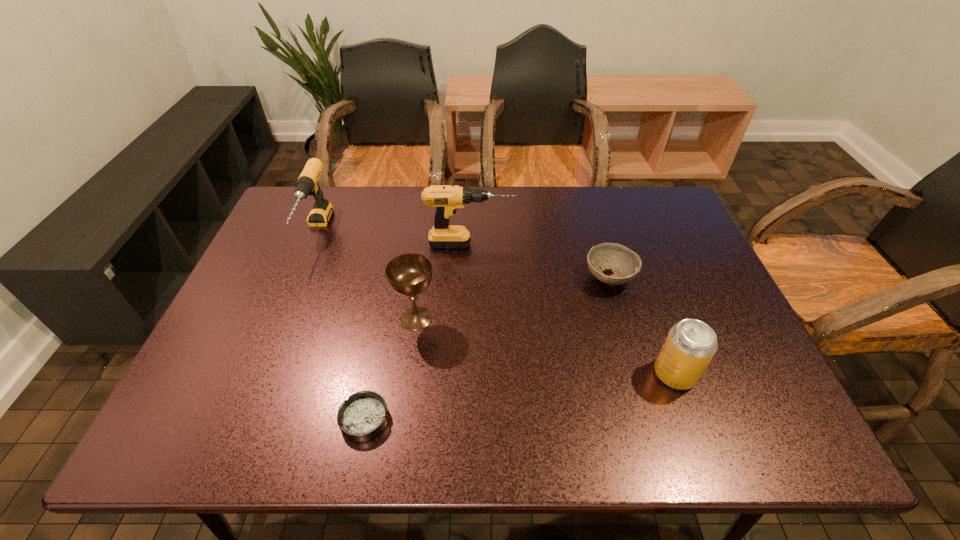
Where is `free location located on the handle side of the left drill`? The width and height of the screenshot is (960, 540). free location located on the handle side of the left drill is located at coordinates 285,305.

You are a GUI agent. You are given a task and a screenshot of the screen. Output one action in this format:
    pyautogui.click(x=<x>, y=<y>)
    Task: Click on the vacant region located 0.190m on the right of the third nearest object
    The width and height of the screenshot is (960, 540).
    Given the screenshot: What is the action you would take?
    pyautogui.click(x=516, y=319)

Where is `vacant region located on the left of the third shortest object`? The height and width of the screenshot is (540, 960). vacant region located on the left of the third shortest object is located at coordinates (535, 374).

Where is `vacant area located on the back of the fifth tallest object`? vacant area located on the back of the fifth tallest object is located at coordinates (584, 189).

Where is `free point located 0.170m on the left of the ashtray`? This screenshot has height=540, width=960. free point located 0.170m on the left of the ashtray is located at coordinates pyautogui.click(x=256, y=419).

Where is `object that is at the far edge`? This screenshot has width=960, height=540. object that is at the far edge is located at coordinates (307, 184).

Identify the location of object located at the near edge. (363, 416).

This screenshot has width=960, height=540. Identify the location of object that is at the left edge. 307,184.

Locate an element on the screen. object that is at the right edge is located at coordinates (690, 345).

This screenshot has width=960, height=540. Identify the location of object located at the far left corner. click(x=307, y=184).